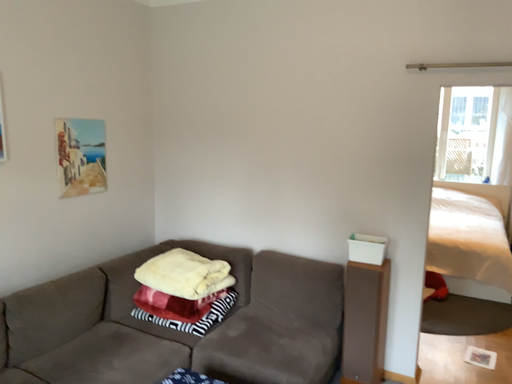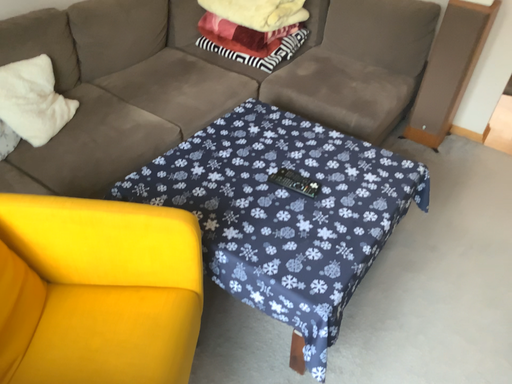
Question: Which way did the camera rotate in the video?

Choices:
 (A) rotated downward
 (B) rotated upward

Answer: (A)